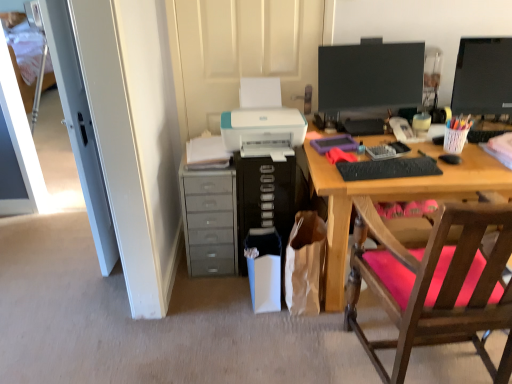
Find the location of `free space to the left of white plastic trash can at center, acting as the third stationery starting from the right`. free space to the left of white plastic trash can at center, acting as the third stationery starting from the right is located at coordinates pos(225,298).